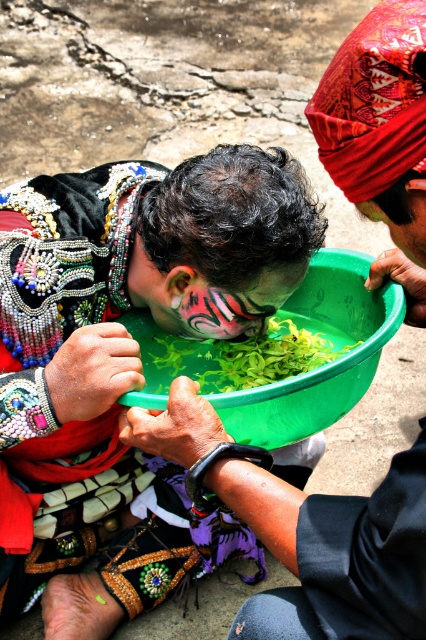
Who is taller, matte black face paint at center or painted tiger face at center?

With more height is matte black face paint at center.

Can you confirm if matte black face paint at center is positioned below painted tiger face at center?

Indeed, matte black face paint at center is positioned under painted tiger face at center.

The image size is (426, 640). What are the coordinates of `matte black face paint at center` in the screenshot? It's located at (121, 358).

Does matte black face paint at center have a larger size compared to matte green bowl at center?

Correct, matte black face paint at center is larger in size than matte green bowl at center.

Who is more forward, (120, 490) or (324, 516)?

Point (324, 516) is more forward.

Find the location of a particular element. Image resolution: width=426 pixels, height=640 pixels. matte black face paint at center is located at coordinates (121, 358).

Is point (302, 305) behind point (261, 310)?

Yes, it is.

Identify the location of green plastic bowl at center. (290, 376).